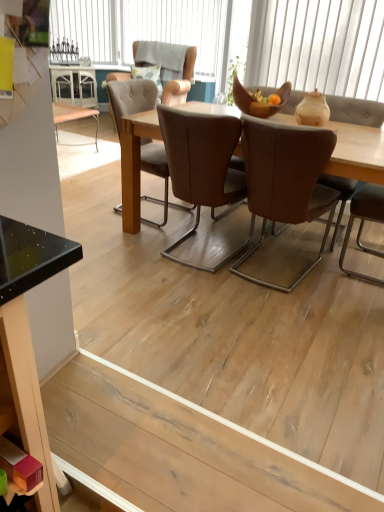
Question: Is white textured window at upper center, which is the 1th window in bottom-to-top order, taller or shorter than light brown leather chair at upper center, which ranks as the first chair in back-to-front order?

Choices:
 (A) tall
 (B) short

Answer: (B)

Question: From a real-world perspective, is white textured window at upper center, arranged as the third window when viewed from the left, positioned above or below light brown leather chair at upper center, which is counted as the third chair, starting from the front?

Choices:
 (A) below
 (B) above

Answer: (B)

Question: Estimate the real-world distances between objects in this image. Which object is closer to the natural wood table at center?

Choices:
 (A) brown leather chair at center, which is the 2th chair from bottom to top
 (B) white textured window at upper center, which is the third window from back to front
 (C) clear glass wine rack at upper left, marked as the first window in a left-to-right arrangement
 (D) white textured cushion at upper center, acting as the second window starting from the top
 (E) fluffy fabric pillow at upper center

Answer: (A)

Question: Based on their relative distances, which object is farther from the clear glass wine rack at upper left, the third window from the bottom?

Choices:
 (A) white textured cushion at upper center, acting as the 2th window starting from the back
 (B) light brown leather chair at upper center, acting as the 1th chair starting from the top
 (C) natural wood table at center
 (D) matte brown bowl at center
 (E) brown leather chair at center, placed as the second chair when sorted from back to front

Answer: (E)